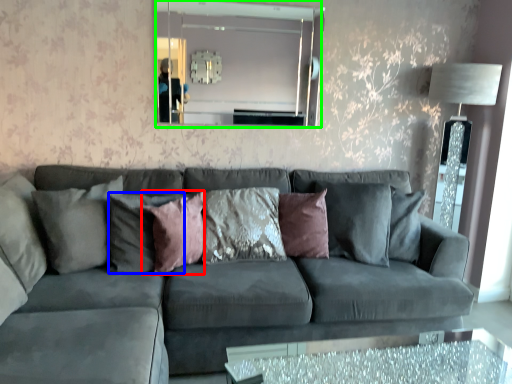
Question: Which is farther away from pillow (highlighted by a red box)? pillow (highlighted by a blue box) or mirror (highlighted by a green box)?

Choices:
 (A) pillow
 (B) mirror

Answer: (B)